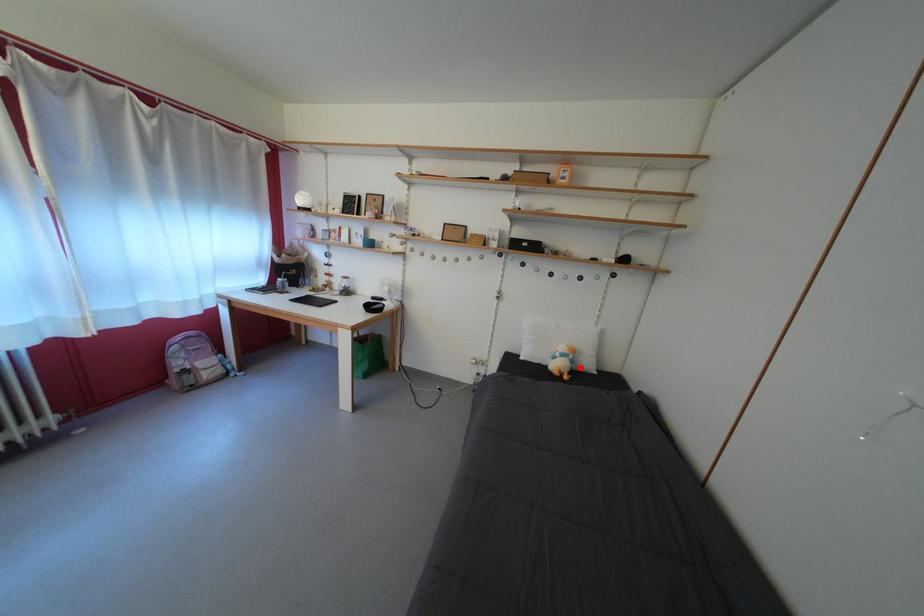
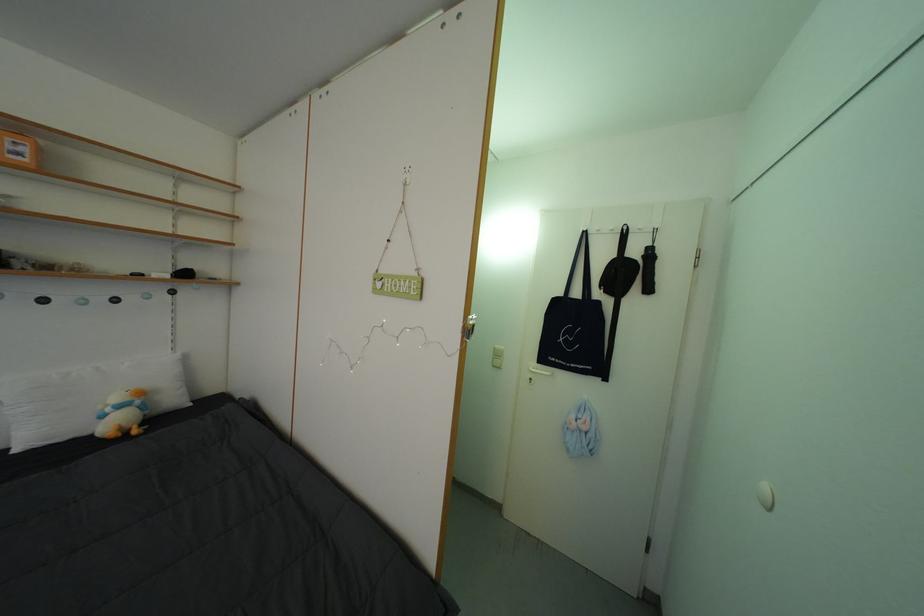
Locate, in the second image, the point that corresponds to the highlighted location in the first image.

(152, 413)